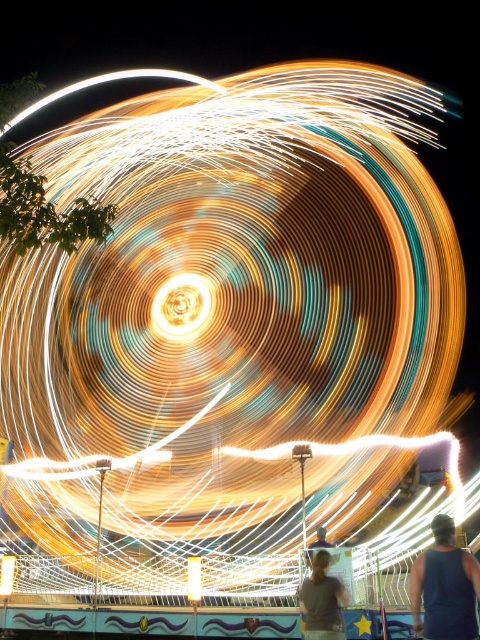
Can you confirm if golden spiral at center is taller than gray matte shirt at lower center?

Yes.

Is golden spiral at center positioned at the back of gray matte shirt at lower center?

That is True.

Describe the element at coordinates (180, 305) in the screenshot. This screenshot has height=640, width=480. I see `golden spiral at center` at that location.

The image size is (480, 640). I want to click on golden spiral at center, so click(x=180, y=305).

Image resolution: width=480 pixels, height=640 pixels. What do you see at coordinates (444, 586) in the screenshot?
I see `dark blue tank top at lower right` at bounding box center [444, 586].

Which is behind, point (451, 625) or point (197, 285)?

The point (197, 285) is more distant.

Find the location of a particular element. This screenshot has width=480, height=640. dark blue tank top at lower right is located at coordinates (444, 586).

Is dark blue tank top at lower right closer to camera compared to yellow/golden metallic light at center?

Yes, it is.

Does dark blue tank top at lower right appear under yellow/golden metallic light at center?

No.

The image size is (480, 640). What are the coordinates of `dark blue tank top at lower right` in the screenshot? It's located at (444, 586).

Find the location of a particular element. dark blue tank top at lower right is located at coordinates (444, 586).